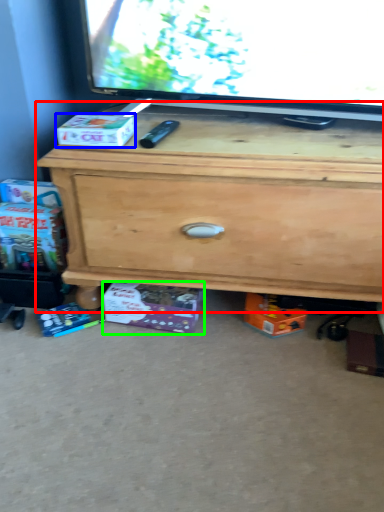
Question: Considering the real-world distances, which object is farthest from chest of drawers (highlighted by a red box)? box (highlighted by a blue box) or box (highlighted by a green box)?

Choices:
 (A) box
 (B) box

Answer: (A)